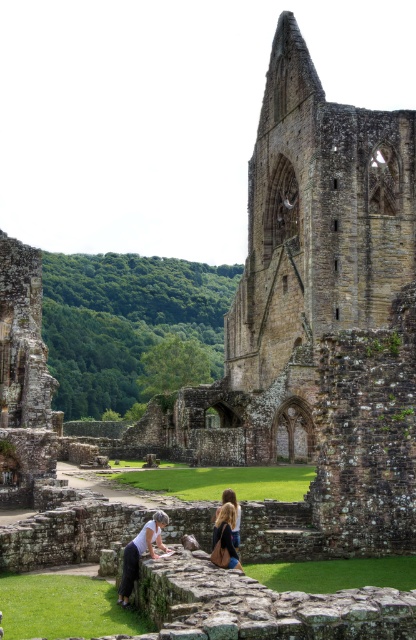
Is green grass at lower left thinner than green grass at center?

Yes.

Who is more distant from viewer, [101,628] or [116,477]?

Positioned behind is point [116,477].

The height and width of the screenshot is (640, 416). I want to click on green grass at lower left, so click(64, 608).

Locate an element on the screen. green grass at lower left is located at coordinates (64, 608).

Which is in front, point (118, 609) or point (160, 525)?

Point (118, 609) is more forward.

Who is more forward, (x=69, y=596) or (x=163, y=548)?

Point (x=163, y=548)

Locate an element on the screen. This screenshot has width=416, height=640. green grass at lower left is located at coordinates (64, 608).

Is matte black hair at lower center wider than blonde hair at center?

Yes, matte black hair at lower center is wider than blonde hair at center.

Between point (217, 508) and point (227, 524), which one is positioned in front?

Point (227, 524) is in front.

At what (x,y) coordinates should I click in order to perform the action: click on matte black hair at lower center. Please return your answer as a coordinate pair (x, y). The height and width of the screenshot is (640, 416). Looking at the image, I should click on (126, 573).